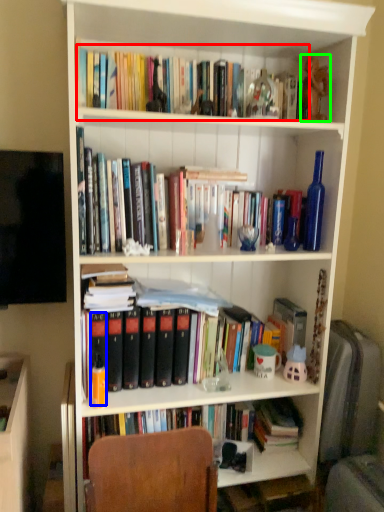
Question: Based on their relative distances, which object is nearer to book (highlighted by a red box)? Choose from paperback book (highlighted by a blue box) and toy (highlighted by a green box).

Choices:
 (A) paperback book
 (B) toy

Answer: (B)